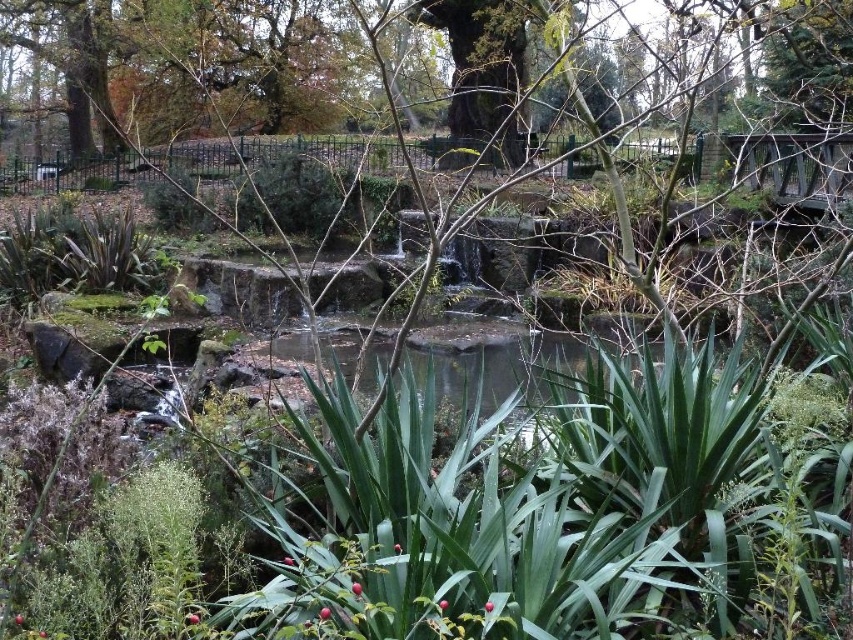
You are a hiker who wants to take a photo of the green mossy pond at center from the green mossy tree at upper center. Is the tree positioned in a way that you can stand on it to get a better view of the pond?

The green mossy tree at upper center is above the green mossy pond at center, so yes, you can stand on the tree to get a better view of the pond since it is positioned higher up.